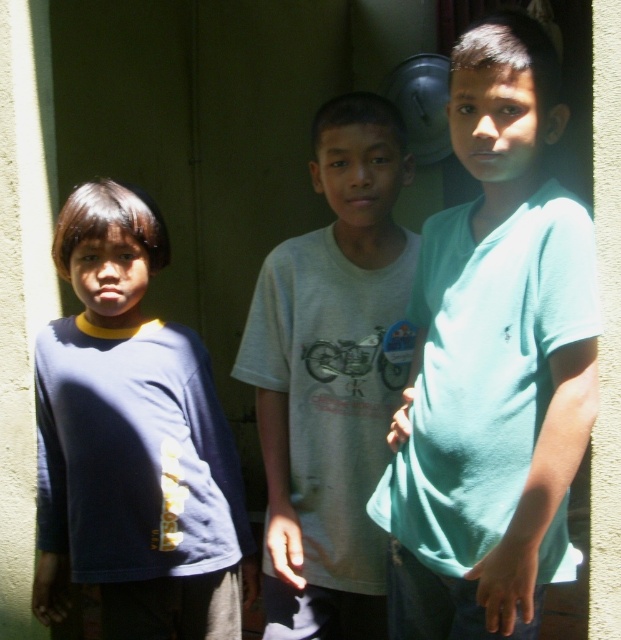
Who is positioned more to the right, teal matte shirt at center or dark blue t-shirt at left?

teal matte shirt at center

Who is more distant from viewer, [496,44] or [163,467]?

Point [163,467]

Which is behind, point (481, 632) or point (65, 468)?

The point (65, 468) is behind.

The height and width of the screenshot is (640, 621). Find the location of `teal matte shirt at center`. teal matte shirt at center is located at coordinates (492, 362).

From the picture: Is dark blue t-shirt at left smaller than white cotton shirt at center?

No, dark blue t-shirt at left is not smaller than white cotton shirt at center.

Between dark blue t-shirt at left and white cotton shirt at center, which one appears on the right side from the viewer's perspective?

white cotton shirt at center is more to the right.

Looking at this image, who is more forward, (55, 240) or (340, 97)?

Point (340, 97) is in front.

Locate an element on the screen. The width and height of the screenshot is (621, 640). dark blue t-shirt at left is located at coordinates (132, 442).

Is teal matte shirt at center taller than white cotton shirt at center?

No.

Does point (582, 221) lie behind point (268, 333)?

That is False.

At what (x,y) coordinates should I click in order to perform the action: click on teal matte shirt at center. Please return your answer as a coordinate pair (x, y). The image size is (621, 640). Looking at the image, I should click on (492, 362).